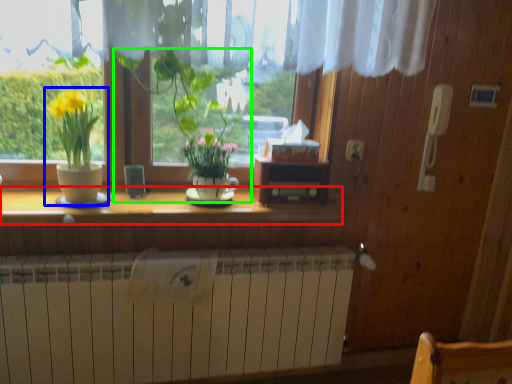
Question: Which object is the closest to the counter top (highlighted by a red box)? Choose among these: houseplant (highlighted by a blue box) or houseplant (highlighted by a green box).

Choices:
 (A) houseplant
 (B) houseplant

Answer: (A)